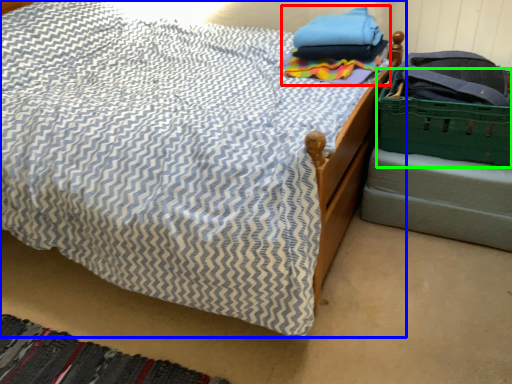
Question: Which is nearer to the clothing (highlighted by a red box)? bed (highlighted by a blue box) or basket (highlighted by a green box).

Choices:
 (A) bed
 (B) basket

Answer: (B)